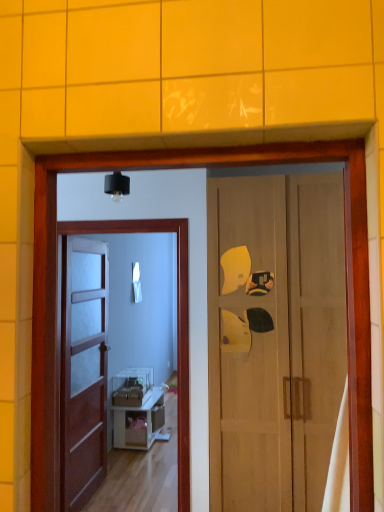
Measure the distance between white glossy cabinet at center and camera.

A distance of 3.81 meters exists between white glossy cabinet at center and camera.

I want to click on wooden door at right, the 2th door positioned from the left, so click(x=274, y=338).

This screenshot has height=512, width=384. Describe the element at coordinates (136, 282) in the screenshot. I see `white glossy mirror at center` at that location.

The height and width of the screenshot is (512, 384). I want to click on clear glass screen door at center, so click(x=177, y=322).

From the picture: Considering the sizes of clear glass screen door at center and brown wooden door at center, marked as the 2th door in a right-to-left arrangement, in the image, is clear glass screen door at center wider or thinner than brown wooden door at center, marked as the 2th door in a right-to-left arrangement,?

clear glass screen door at center is thinner than brown wooden door at center, marked as the 2th door in a right-to-left arrangement.

Is clear glass screen door at center not close to brown wooden door at center, marked as the 2th door in a right-to-left arrangement?

No, clear glass screen door at center is not far away from brown wooden door at center, marked as the 2th door in a right-to-left arrangement.

The width and height of the screenshot is (384, 512). In order to click on screen door above the brown wooden door at center, marked as the 2th door in a right-to-left arrangement (from a real-world perspective) in this screenshot , I will do `click(177, 322)`.

Consider the image. Is clear glass screen door at center outside of brown wooden door at center, marked as the 2th door in a right-to-left arrangement?

Yes, clear glass screen door at center is outside of brown wooden door at center, marked as the 2th door in a right-to-left arrangement.

Does brown wooden door at center, marked as the 2th door in a right-to-left arrangement, have a greater height compared to clear glass screen door at center?

Correct, brown wooden door at center, marked as the 2th door in a right-to-left arrangement, is much taller as clear glass screen door at center.

How many degrees apart are the facing directions of brown wooden door at center, the 1th door when ordered from left to right, and clear glass screen door at center?

The angle between the facing direction of brown wooden door at center, the 1th door when ordered from left to right, and the facing direction of clear glass screen door at center is 90.9 degrees.

Which point is more forward, (73,417) or (182,400)?

The point (182,400) is more forward.

Does brown wooden door at center, marked as the 2th door in a right-to-left arrangement, appear on the right side of clear glass screen door at center?

No, brown wooden door at center, marked as the 2th door in a right-to-left arrangement, is not to the right of clear glass screen door at center.

From a real-world perspective, is white glossy cabinet at center below brown wooden door at center, marked as the 2th door in a right-to-left arrangement?

Yes, from a real-world perspective, white glossy cabinet at center is beneath brown wooden door at center, marked as the 2th door in a right-to-left arrangement.

Considering the sizes of objects white glossy cabinet at center and brown wooden door at center, the 1th door when ordered from left to right, in the image provided, who is wider, white glossy cabinet at center or brown wooden door at center, the 1th door when ordered from left to right,?

With larger width is white glossy cabinet at center.

Is white glossy cabinet at center far from brown wooden door at center, the 1th door when ordered from left to right?

No, white glossy cabinet at center is not far from brown wooden door at center, the 1th door when ordered from left to right.

Could you tell me if white glossy cabinet at center is turned towards brown wooden door at center, the 1th door when ordered from left to right?

No, white glossy cabinet at center does not turn towards brown wooden door at center, the 1th door when ordered from left to right.

Which point is more forward, (x=329, y=393) or (x=101, y=278)?

Positioned in front is point (x=329, y=393).

Is wooden door at right, the 2th door positioned from the left, completely or partially outside of brown wooden door at center, marked as the 2th door in a right-to-left arrangement?

Yes, wooden door at right, the 2th door positioned from the left, is located beyond the bounds of brown wooden door at center, marked as the 2th door in a right-to-left arrangement.

From the image's perspective, between wooden door at right, the 2th door positioned from the left, and brown wooden door at center, marked as the 2th door in a right-to-left arrangement, who is located below?

brown wooden door at center, marked as the 2th door in a right-to-left arrangement, appears lower in the image.

Is wooden door at right, which ranks as the 1th door in right-to-left order, far from brown wooden door at center, marked as the 2th door in a right-to-left arrangement?

That's right, there is a large distance between wooden door at right, which ranks as the 1th door in right-to-left order, and brown wooden door at center, marked as the 2th door in a right-to-left arrangement.

Is clear glass screen door at center touching white glossy mirror at center?

clear glass screen door at center and white glossy mirror at center are clearly separated.

How distant is clear glass screen door at center from white glossy mirror at center?

clear glass screen door at center and white glossy mirror at center are 1.32 meters apart.

Consider the image. From a real-world perspective, which object stands above the other?

From a 3D spatial view, white glossy mirror at center is above.

Is clear glass screen door at center spatially inside white glossy mirror at center, or outside of it?

clear glass screen door at center exists outside the volume of white glossy mirror at center.

Who is shorter, wooden door at right, which ranks as the 1th door in right-to-left order, or white glossy cabinet at center?

With less height is white glossy cabinet at center.

From a real-world perspective, is wooden door at right, the 2th door positioned from the left, physically located above or below white glossy cabinet at center?

Clearly, from a real-world perspective, wooden door at right, the 2th door positioned from the left, is above white glossy cabinet at center.

From the picture: Is wooden door at right, which ranks as the 1th door in right-to-left order, far away from white glossy cabinet at center?

Yes, wooden door at right, which ranks as the 1th door in right-to-left order, and white glossy cabinet at center are located far from each other.

Could you measure the distance between wooden door at right, which ranks as the 1th door in right-to-left order, and white glossy cabinet at center?

1.85 meters.

Between white glossy cabinet at center and white glossy mirror at center, which one has smaller size?

white glossy mirror at center.

Is white glossy cabinet at center not close to white glossy mirror at center?

Yes, white glossy cabinet at center is far from white glossy mirror at center.

Could you tell me if white glossy cabinet at center is facing white glossy mirror at center?

No, white glossy cabinet at center does not turn towards white glossy mirror at center.

Which is in front, point (144, 438) or point (138, 300)?

Positioned in front is point (138, 300).

Locate an element on the screen. This screenshot has height=512, width=384. door behind the clear glass screen door at center is located at coordinates (83, 369).

Where is `screen door in front of the brown wooden door at center, marked as the 2th door in a right-to-left arrangement`? Image resolution: width=384 pixels, height=512 pixels. screen door in front of the brown wooden door at center, marked as the 2th door in a right-to-left arrangement is located at coordinates (177, 322).

From the image, which object appears to be nearer to brown wooden door at center, marked as the 2th door in a right-to-left arrangement, white glossy cabinet at center or clear glass screen door at center?

Based on the image, white glossy cabinet at center appears to be nearer to brown wooden door at center, marked as the 2th door in a right-to-left arrangement.

Looking at the image, which one is located further to white glossy cabinet at center, white glossy mirror at center or brown wooden door at center, the 1th door when ordered from left to right?

The object further to white glossy cabinet at center is white glossy mirror at center.

Estimate the real-world distances between objects in this image. Which object is further from wooden door at right, which ranks as the 1th door in right-to-left order, brown wooden door at center, marked as the 2th door in a right-to-left arrangement, or white glossy cabinet at center?

white glossy cabinet at center lies further to wooden door at right, which ranks as the 1th door in right-to-left order, than the other object.

Based on their spatial positions, is white glossy cabinet at center or wooden door at right, the 2th door positioned from the left, closer to brown wooden door at center, marked as the 2th door in a right-to-left arrangement?

Based on the image, white glossy cabinet at center appears to be nearer to brown wooden door at center, marked as the 2th door in a right-to-left arrangement.

From the image, which object appears to be farther from white glossy cabinet at center, brown wooden door at center, the 1th door when ordered from left to right, or wooden door at right, the 2th door positioned from the left?

The object further to white glossy cabinet at center is wooden door at right, the 2th door positioned from the left.

Which object lies further to the anchor point white glossy mirror at center, white glossy cabinet at center or clear glass screen door at center?

clear glass screen door at center is positioned further to the anchor white glossy mirror at center.

Which object lies further to the anchor point clear glass screen door at center, brown wooden door at center, marked as the 2th door in a right-to-left arrangement, or white glossy mirror at center?

The object further to clear glass screen door at center is white glossy mirror at center.

Considering their positions, is clear glass screen door at center positioned closer to white glossy cabinet at center than white glossy mirror at center?

white glossy mirror at center is positioned closer to the anchor white glossy cabinet at center.

Where is `cabinetry between clear glass screen door at center and white glossy mirror at center in the front-back direction`? cabinetry between clear glass screen door at center and white glossy mirror at center in the front-back direction is located at coordinates [x=140, y=423].

You are a GUI agent. You are given a task and a screenshot of the screen. Output one action in this format:
    pyautogui.click(x=<x>, y=<y>)
    Task: Click on the cabinetry located between brown wooden door at center, the 1th door when ordered from left to right, and white glossy mirror at center in the depth direction
    The image size is (384, 512).
    Given the screenshot: What is the action you would take?
    pyautogui.click(x=140, y=423)

Where is `door positioned between clear glass screen door at center and white glossy mirror at center from near to far`? The image size is (384, 512). door positioned between clear glass screen door at center and white glossy mirror at center from near to far is located at coordinates (83, 369).

Image resolution: width=384 pixels, height=512 pixels. Identify the location of screen door between wooden door at right, the 2th door positioned from the left, and white glossy mirror at center in the front-back direction. (177, 322).